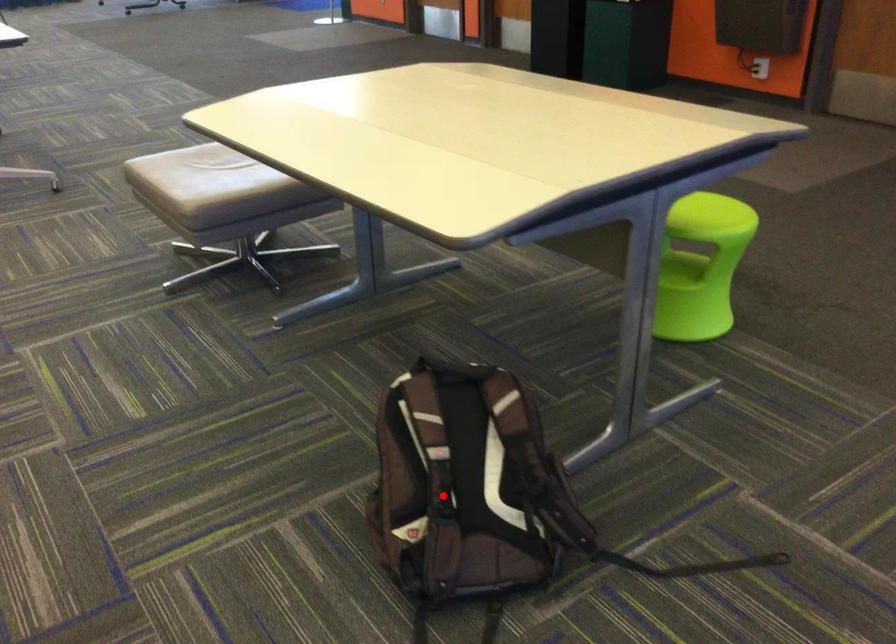
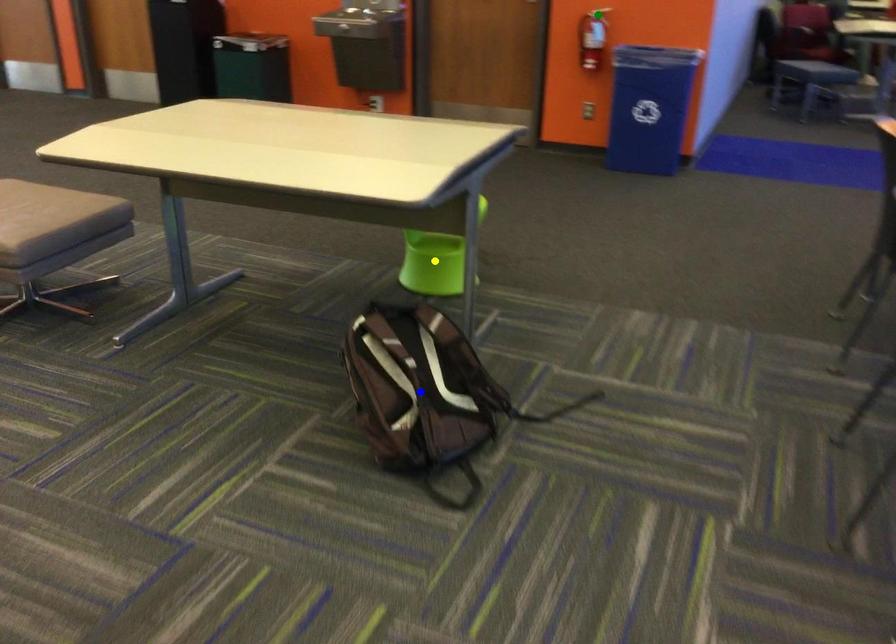
Question: I am providing you with two images of the same scene from different viewpoints. A red point is marked on the first image. You are given multiple points on the second image. Which point in image 2 is actually the same real-world point as the red point in image 1?

Choices:
 (A) blue point
 (B) yellow point
 (C) green point

Answer: (A)